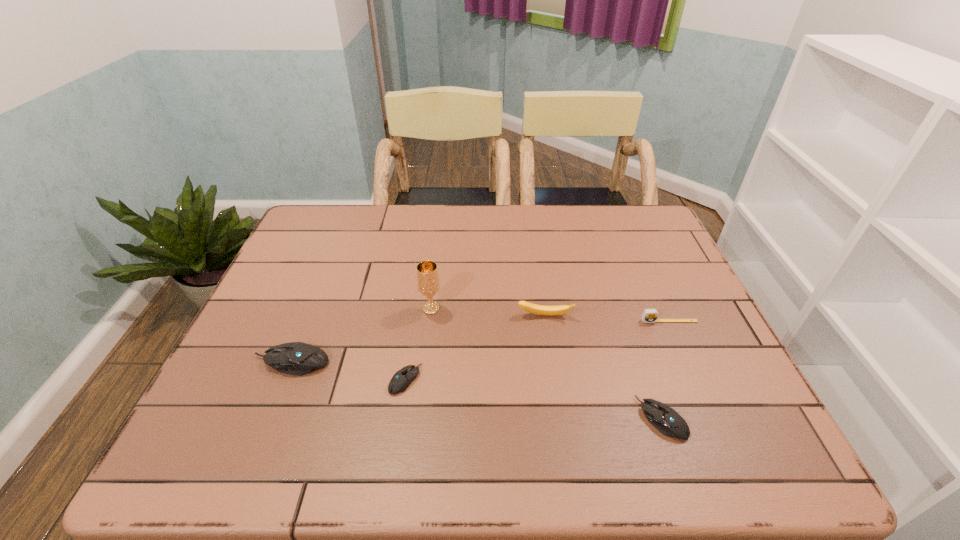
Choose which computer mouse is the nearest neighbor to the tape measure. Please provide its 2D coordinates. Your answer should be formatted as a tuple, i.e. [(x, y)], where the tuple contains the x and y coordinates of a point satisfying the conditions above.

[(665, 419)]

At what (x,y) coordinates should I click in order to perform the action: click on free space in the image that satisfies the following two spatial constraints: 1. on the front side of the nearest object; 2. on the left side of the shortest computer mouse. Please return your answer as a coordinate pair (x, y). The width and height of the screenshot is (960, 540). Looking at the image, I should click on (399, 418).

Image resolution: width=960 pixels, height=540 pixels. I want to click on free location that satisfies the following two spatial constraints: 1. at the stem of the second tallest computer mouse; 2. on the right side of the banana, so click(x=561, y=418).

This screenshot has height=540, width=960. I want to click on free spot that satisfies the following two spatial constraints: 1. at the stem of the second shortest object; 2. on the right side of the second tallest object, so click(x=561, y=418).

Locate an element on the screen. The image size is (960, 540). vacant region that satisfies the following two spatial constraints: 1. on the back side of the tallest object; 2. on the right side of the leftmost object is located at coordinates (313, 309).